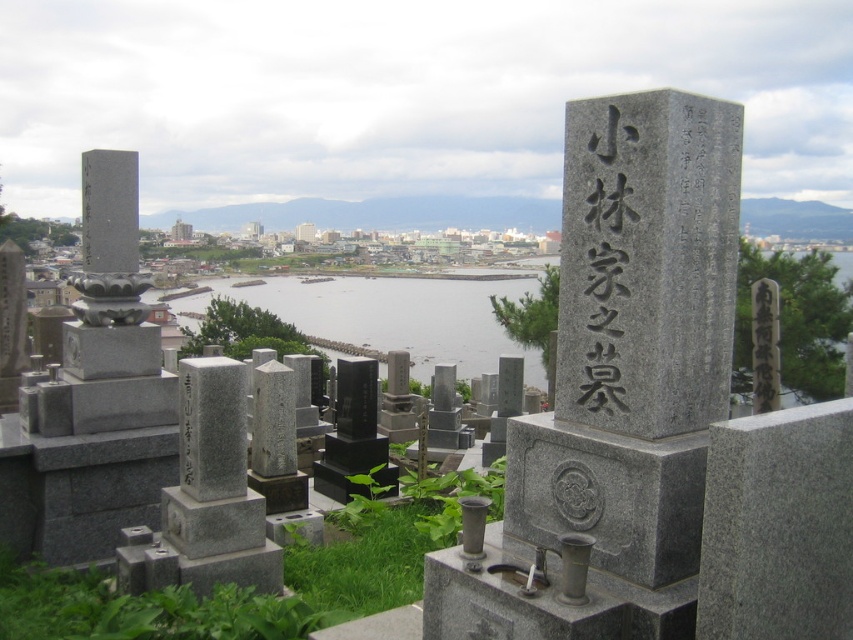
You are standing at the point marked by the coordinates point (602,220) in the cemetery. Looking around, you see several gray stone gravestones with Japanese inscriptions and some green plants in the midground. Which object is directly in front of you at those coordinates?

The point (602,220) marks the black stone inscription at center, so the black stone inscription at center is directly in front of you at those coordinates.

You are standing at the center of the cemetery and want to find the gray stone monument at center. According to the coordinates given, where should you look relative to your position?

The gray stone monument at center is located at coordinates 0.522 on the x axis and 0.746 on the y axis relative to your position.

You are standing at the cemetery overlooking the coastal city. You notice the clear water at center and the black stone inscription at center. Which object is positioned higher in the scene?

The clear water at center is located above the black stone inscription at center, so it is positioned higher in the scene.